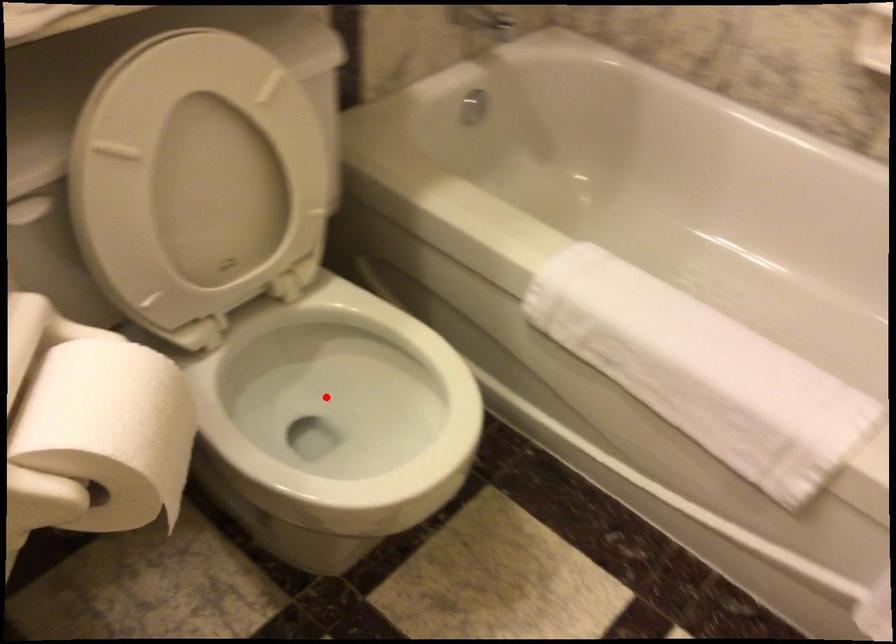
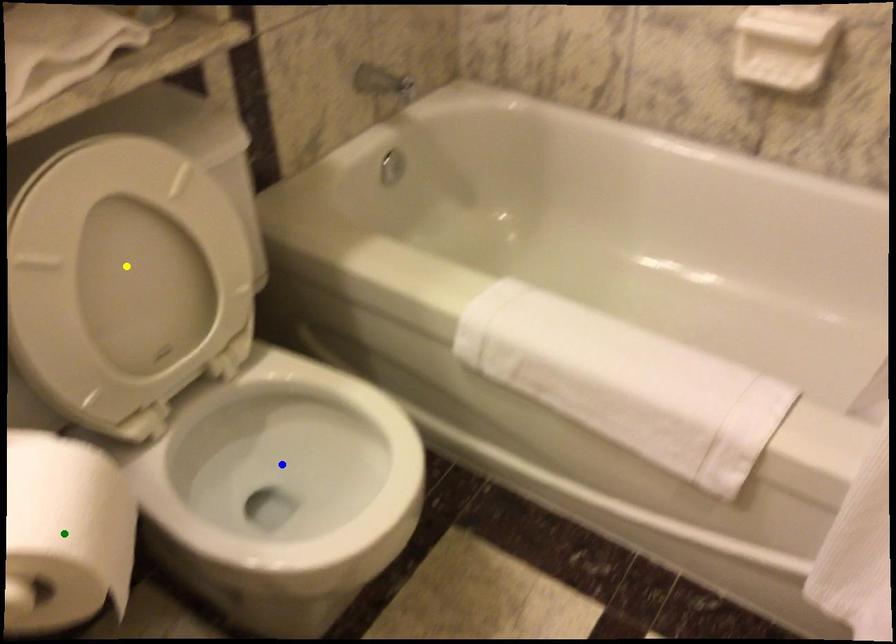
Question: I am providing you with two images of the same scene from different viewpoints. A red point is marked on the first image. You are given multiple points on the second image. Can you choose the point in image 2 that corresponds to the point in image 1?

Choices:
 (A) yellow point
 (B) blue point
 (C) green point

Answer: (B)